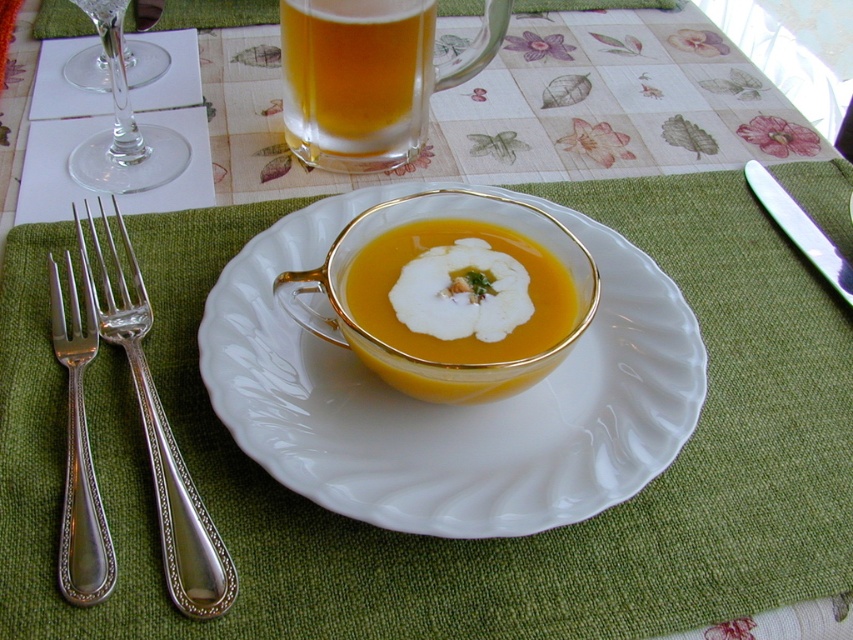
You are a diner who wants to choose the taller utensil between the silvermetallicfork at left and the silver polished knife at upper right to eat your soup. Which one should you pick?

The silvermetallicfork at left is taller than the silver polished knife at upper right, so you should pick the silvermetallicfork at left to eat your soup.

You are a food photographer setting up a shot. The golden glass bowl at center needs to be the main focus. Given that it is 8.80 inches away from the camera, would you consider moving it closer to achieve a better closeup without changing the camera settings?

The golden glass bowl at center is 8.80 inches away from the camera. To achieve a better closeup without changing camera settings, moving it closer would reduce depth of field and potentially blur the background, but since the current distance is already close, it might be sufficient. However, if a tighter focus is needed, moving it closer could help, but ensure the composition remains balanced.